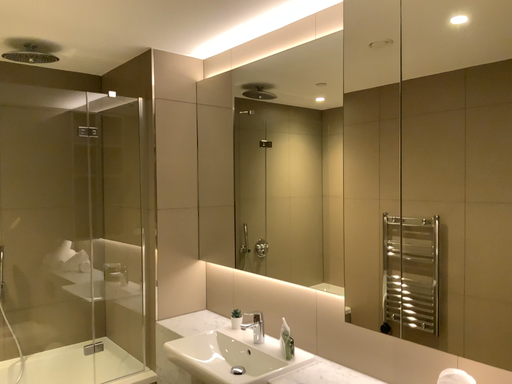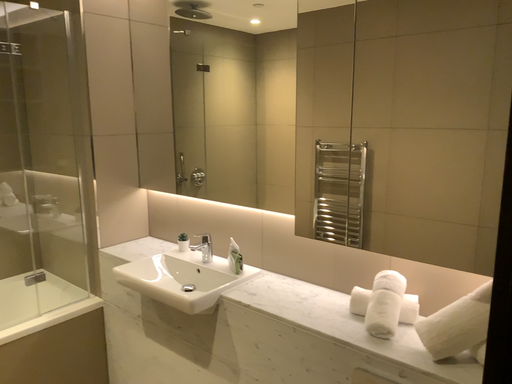
Question: How did the camera likely rotate when shooting the video?

Choices:
 (A) rotated left
 (B) rotated right

Answer: (B)